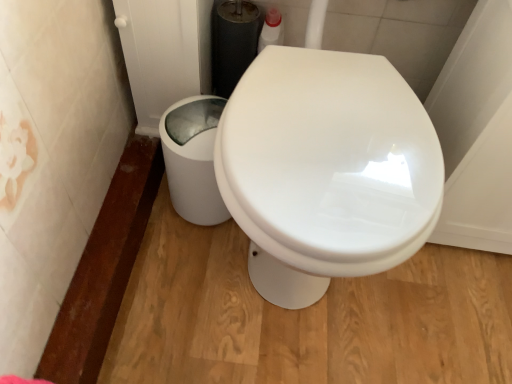
Question: Is point (134, 48) closer or farther from the camera than point (220, 205)?

Choices:
 (A) closer
 (B) farther

Answer: (A)

Question: Visually, is clear glass screen door at upper left positioned to the left or to the right of white glossy trash can at lower left?

Choices:
 (A) left
 (B) right

Answer: (A)

Question: In terms of width, does clear glass screen door at upper left look wider or thinner when compared to white glossy trash can at lower left?

Choices:
 (A) wide
 (B) thin

Answer: (A)

Question: In the image, is white glossy trash can at lower left positioned in front of or behind clear glass screen door at upper left?

Choices:
 (A) front
 (B) behind

Answer: (B)

Question: Which is correct: white glossy trash can at lower left is inside clear glass screen door at upper left, or outside of it?

Choices:
 (A) outside
 (B) inside

Answer: (A)

Question: From a real-world perspective, relative to clear glass screen door at upper left, is white glossy trash can at lower left vertically above or below?

Choices:
 (A) below
 (B) above

Answer: (A)

Question: Is white glossy trash can at lower left taller or shorter than clear glass screen door at upper left?

Choices:
 (A) tall
 (B) short

Answer: (B)